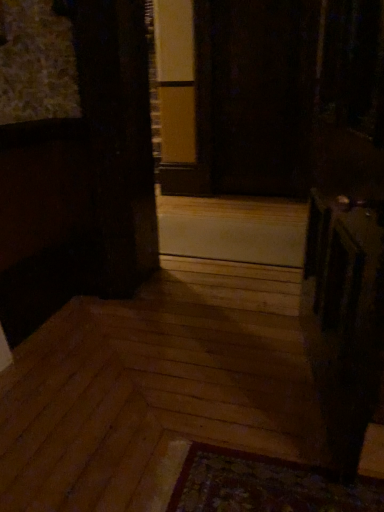
Question: Is transparent glass screen door at center spatially inside white matte panel at center, or outside of it?

Choices:
 (A) outside
 (B) inside

Answer: (A)

Question: Is point (215, 182) positioned closer to the camera than point (263, 241)?

Choices:
 (A) farther
 (B) closer

Answer: (A)

Question: Considering the positions of transparent glass screen door at center and white matte panel at center in the image, is transparent glass screen door at center wider or thinner than white matte panel at center?

Choices:
 (A) wide
 (B) thin

Answer: (B)

Question: Looking at their shapes, would you say white matte panel at center is wider or thinner than transparent glass screen door at center?

Choices:
 (A) thin
 (B) wide

Answer: (B)

Question: Is white matte panel at center bigger or smaller than transparent glass screen door at center?

Choices:
 (A) big
 (B) small

Answer: (B)

Question: Would you say white matte panel at center is to the left or to the right of transparent glass screen door at center in the picture?

Choices:
 (A) left
 (B) right

Answer: (A)

Question: Is point (228, 247) positioned closer to the camera than point (307, 95)?

Choices:
 (A) closer
 (B) farther

Answer: (B)